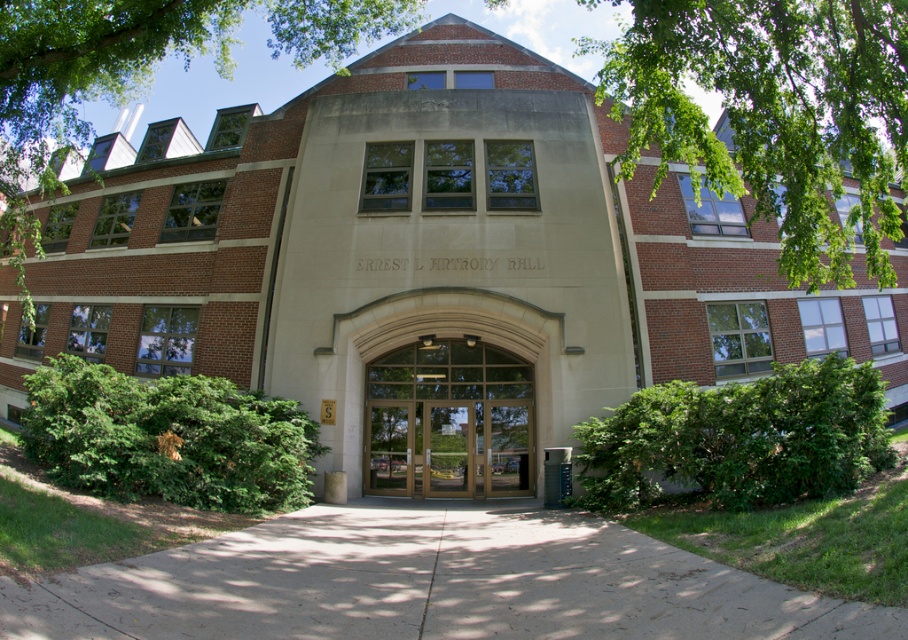
You are standing outside Ernest L. Harrop Hall and want to take a photo of the wooden doors at center without any obstructions. Considering the green leafy tree at upper left, what should you do to avoid it blocking the view?

The green leafy tree at upper left is much taller than the wooden doors at center, so you should position yourself lower or move to a spot where the tree is not directly above the doors to avoid it blocking the view.